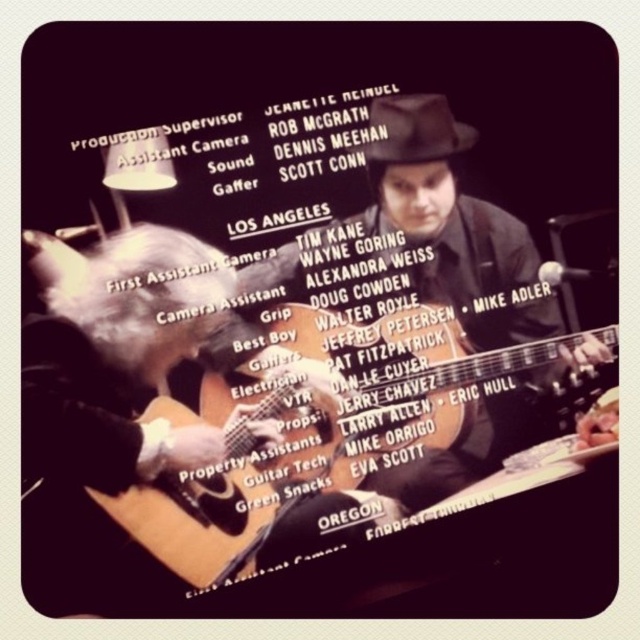
Does matte black guitar at center have a larger size compared to acoustic wood guitar at center?

Incorrect, matte black guitar at center is not larger than acoustic wood guitar at center.

Can you confirm if matte black guitar at center is positioned to the left of acoustic wood guitar at center?

Incorrect, matte black guitar at center is not on the left side of acoustic wood guitar at center.

Between point (243, 280) and point (202, 560), which one is positioned behind?

Positioned behind is point (243, 280).

Identify the location of matte black guitar at center. The image size is (640, 640). pyautogui.click(x=417, y=237).